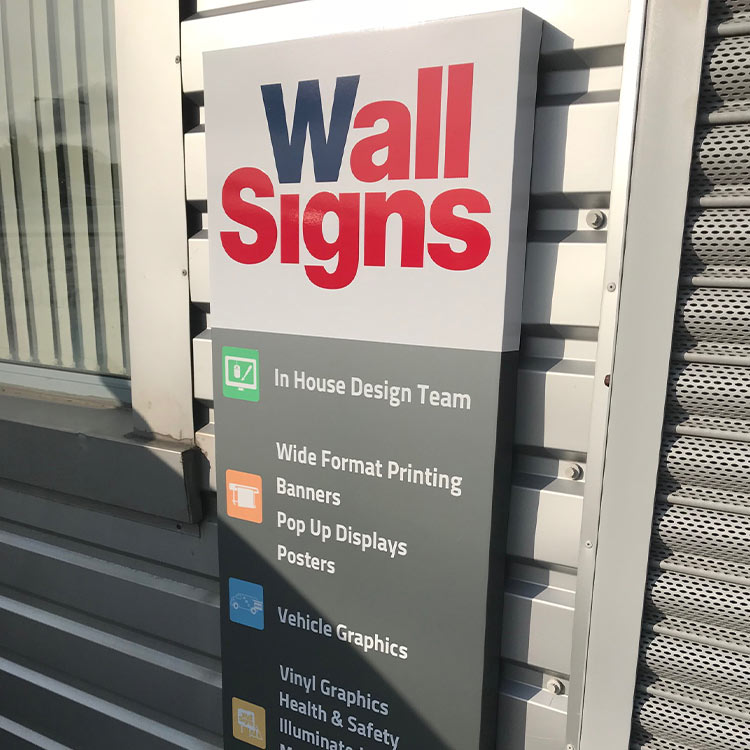
Locate an element on the screen. washer is located at coordinates (579, 472).